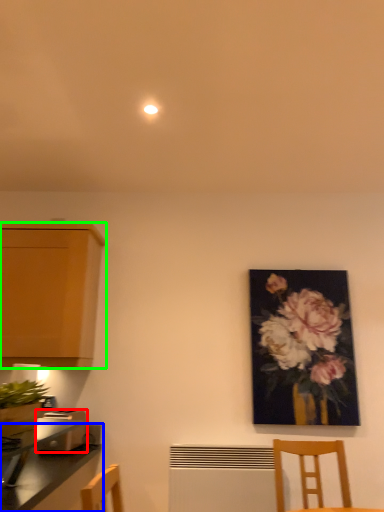
Question: Considering the real-world distances, which object is farthest from toaster (highlighted by a red box)? countertop (highlighted by a blue box) or cabinetry (highlighted by a green box)?

Choices:
 (A) countertop
 (B) cabinetry

Answer: (B)